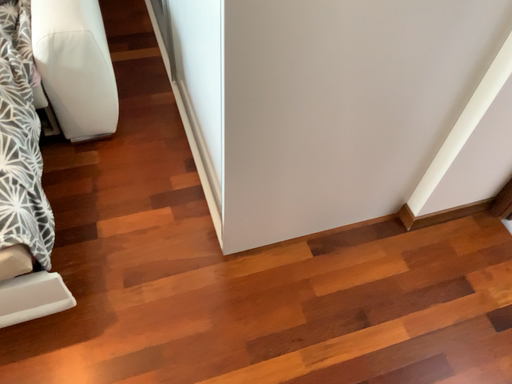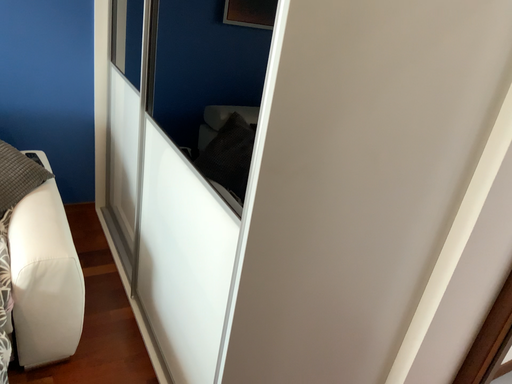
Question: Which way did the camera rotate in the video?

Choices:
 (A) rotated upward
 (B) rotated downward

Answer: (A)